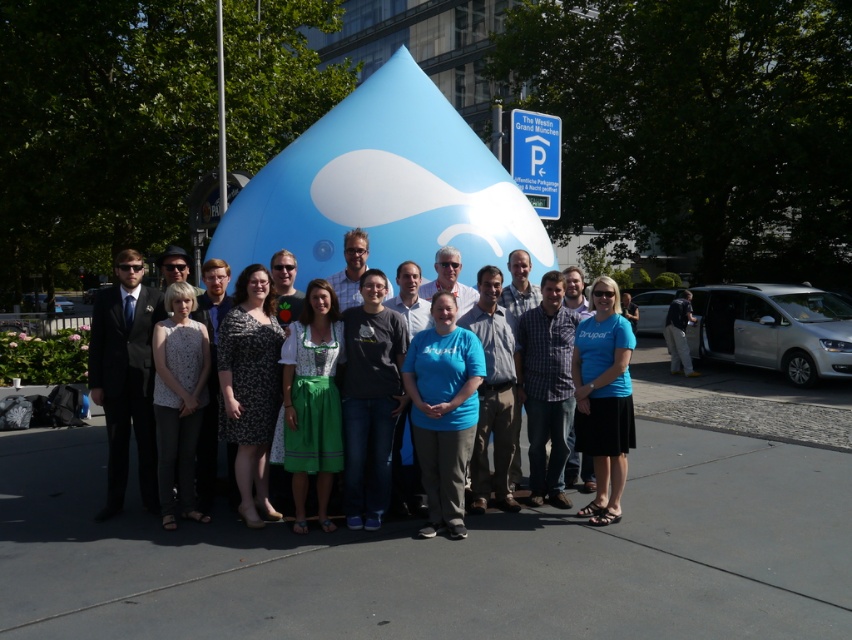
Question: Observing the image, what is the correct spatial positioning of matte black suit at left in reference to blue fabric dress at center?

Choices:
 (A) left
 (B) right

Answer: (A)

Question: Is matte black suit at left behind blue fabric dress at center?

Choices:
 (A) yes
 (B) no

Answer: (A)

Question: Which point appears closest to the camera in this image?

Choices:
 (A) (111, 332)
 (B) (412, 374)

Answer: (B)

Question: Does matte black suit at left have a lesser width compared to blue fabric dress at center?

Choices:
 (A) yes
 (B) no

Answer: (A)

Question: Which of the following is the farthest from the observer?

Choices:
 (A) (122, 356)
 (B) (422, 336)

Answer: (A)